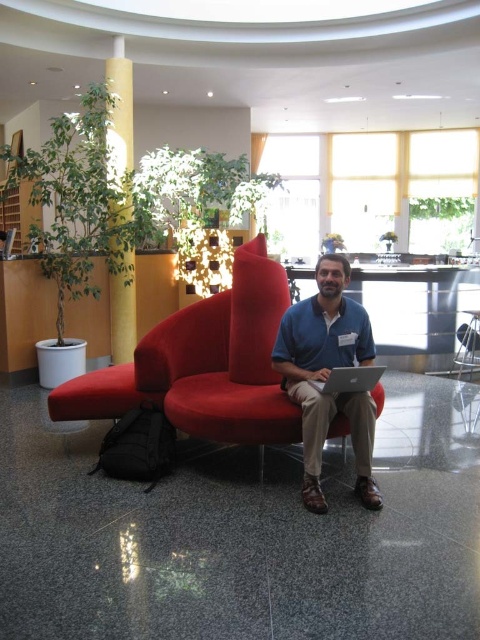
Between yellow textured pillar at upper center and silver metallic laptop at center, which one has less height?

silver metallic laptop at center is shorter.

Is point (109, 141) closer to camera compared to point (340, 376)?

No, (109, 141) is behind (340, 376).

In order to click on yellow textured pillar at upper center in this screenshot , I will do `click(120, 108)`.

Is blue cotton shirt at center smaller than yellow textured pillar at upper center?

No, blue cotton shirt at center is not smaller than yellow textured pillar at upper center.

Is blue cotton shirt at center below yellow textured pillar at upper center?

Yes.

Between point (295, 396) and point (128, 300), which one is positioned in front?

Point (295, 396) is more forward.

I want to click on blue cotton shirt at center, so click(327, 376).

Does yellow textured pillar at upper center appear on the right side of matte black laptop at center?

In fact, yellow textured pillar at upper center is to the left of matte black laptop at center.

Who is taller, yellow textured pillar at upper center or matte black laptop at center?

Standing taller between the two is yellow textured pillar at upper center.

Which is behind, point (131, 99) or point (320, 390)?

The point (131, 99) is more distant.

I want to click on yellow textured pillar at upper center, so click(120, 108).